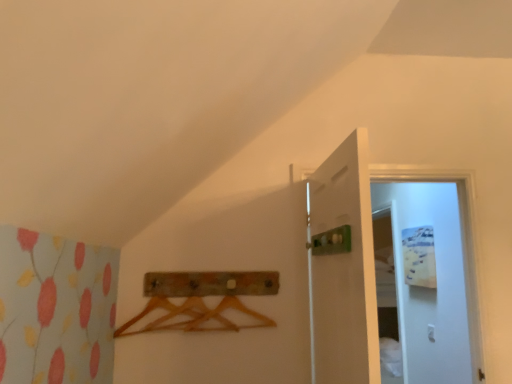
Question: Is wooden coat hanger at center not near white glossy door at upper right, the second door viewed from the left?

Choices:
 (A) no
 (B) yes

Answer: (B)

Question: Could you tell me if wooden coat hanger at center is turned towards white glossy door at upper right, the first door viewed from the right?

Choices:
 (A) yes
 (B) no

Answer: (B)

Question: From the image's perspective, would you say wooden coat hanger at center is shown under white glossy door at upper right, the first door viewed from the right?

Choices:
 (A) no
 (B) yes

Answer: (B)

Question: Is wooden coat hanger at center touching white glossy door at upper right, the second door viewed from the left?

Choices:
 (A) no
 (B) yes

Answer: (A)

Question: Does wooden coat hanger at center have a lesser height compared to white glossy door at upper right, the second door viewed from the left?

Choices:
 (A) no
 (B) yes

Answer: (B)

Question: Considering their positions, is white glossy door at upper right, the second door viewed from the left, located in front of or behind wooden coat hanger at center?

Choices:
 (A) behind
 (B) front

Answer: (B)

Question: Is white glossy door at upper right, the second door viewed from the left, spatially inside wooden coat hanger at center, or outside of it?

Choices:
 (A) inside
 (B) outside

Answer: (B)

Question: From a real-world perspective, is white glossy door at upper right, the first door viewed from the right, physically located above or below wooden coat hanger at center?

Choices:
 (A) above
 (B) below

Answer: (A)

Question: Would you say white glossy door at upper right, the second door viewed from the left, is to the left or to the right of wooden coat hanger at center in the picture?

Choices:
 (A) right
 (B) left

Answer: (A)

Question: Based on their sizes in the image, would you say white matte door at center, the 1th door in the left-to-right sequence, is bigger or smaller than wooden coat hanger at center?

Choices:
 (A) small
 (B) big

Answer: (B)

Question: From a real-world perspective, relative to wooden coat hanger at center, is white matte door at center, the 1th door in the left-to-right sequence, vertically above or below?

Choices:
 (A) above
 (B) below

Answer: (A)

Question: Does point (339, 337) appear closer or farther from the camera than point (265, 292)?

Choices:
 (A) closer
 (B) farther

Answer: (A)

Question: Is white matte door at center, the 1th door in the left-to-right sequence, taller or shorter than wooden coat hanger at center?

Choices:
 (A) tall
 (B) short

Answer: (A)

Question: From their relative heights in the image, would you say wooden coat hanger at center is taller or shorter than white glossy door at upper right, the first door viewed from the right?

Choices:
 (A) tall
 (B) short

Answer: (B)

Question: From a real-world perspective, is wooden coat hanger at center physically located above or below white glossy door at upper right, the first door viewed from the right?

Choices:
 (A) above
 (B) below

Answer: (B)